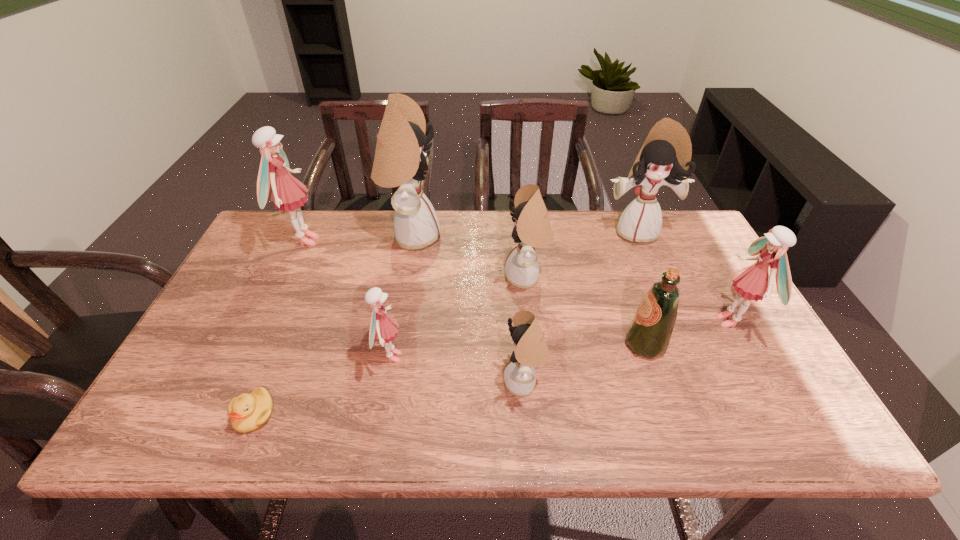
Where is `yellow duckling`? This screenshot has height=540, width=960. yellow duckling is located at coordinates (248, 412).

This screenshot has width=960, height=540. In order to click on the shortest object in this screenshot , I will do `click(248, 412)`.

Where is `free region located at the front face of the tallest object`? free region located at the front face of the tallest object is located at coordinates (472, 236).

At what (x,y) coordinates should I click in order to perform the action: click on blank space located 0.100m on the front-facing side of the farthest pink doll. Please return your answer as a coordinate pair (x, y). The image size is (960, 540). Looking at the image, I should click on (353, 241).

You are a GUI agent. You are given a task and a screenshot of the screen. Output one action in this format:
    pyautogui.click(x=<x>, y=<y>)
    Task: Click on the free location located at the front face of the second biggest black doll
    This screenshot has width=960, height=540.
    Given the screenshot: What is the action you would take?
    pyautogui.click(x=649, y=264)

Where is `vacant space situated on the front-facing side of the second smallest pink doll`? vacant space situated on the front-facing side of the second smallest pink doll is located at coordinates (653, 322).

Locate an element on the screen. vacant space situated 0.300m on the front-facing side of the second smallest pink doll is located at coordinates (599, 322).

I want to click on vacant space positioned on the front-facing side of the second smallest pink doll, so click(595, 322).

Locate an element on the screen. Image resolution: width=960 pixels, height=540 pixels. vacant space located at the front face of the third biggest black doll is located at coordinates (449, 277).

This screenshot has height=540, width=960. What are the coordinates of `vacant space located at the front face of the third biggest black doll` in the screenshot? It's located at (449, 277).